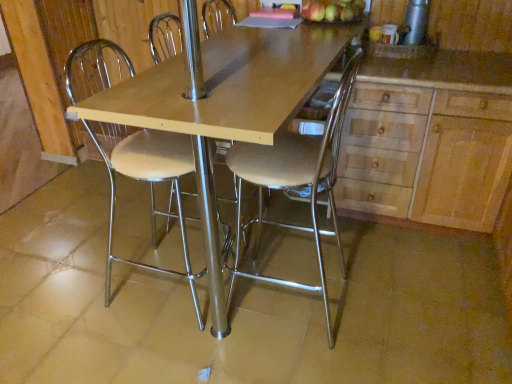
The image size is (512, 384). Identify the location of free area in between metallic silver chair at center, which is the 1th chair from right to left, and metallic silver stool at center, the first chair in the left-to-right sequence. (250, 315).